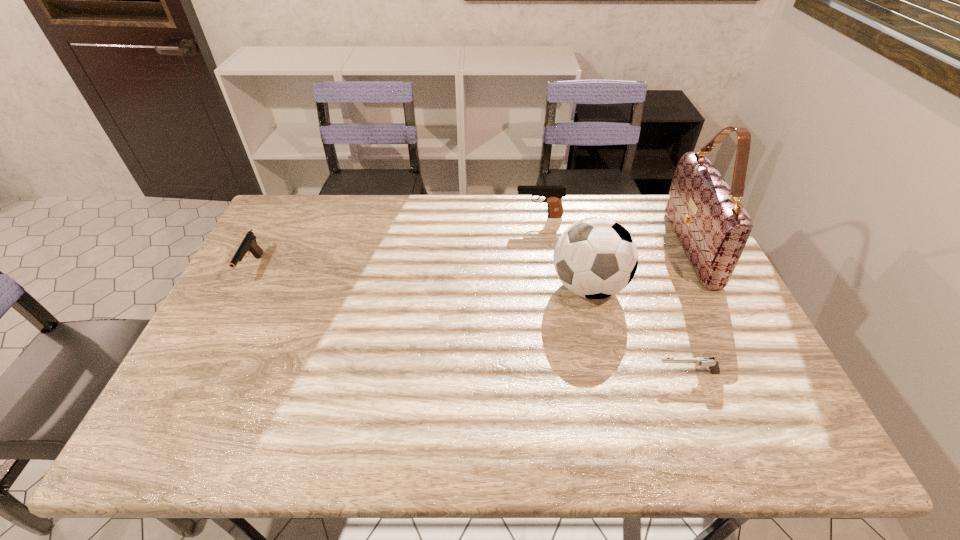
At what (x,y) coordinates should I click in order to perform the action: click on vacant space at the left edge of the desktop. Please return your answer as a coordinate pair (x, y). This screenshot has width=960, height=540. Looking at the image, I should click on (272, 308).

At what (x,y) coordinates should I click in order to perform the action: click on vacant region at the right edge. Please return your answer as a coordinate pair (x, y). The height and width of the screenshot is (540, 960). Looking at the image, I should click on (755, 373).

In order to click on free space at the far left corner of the desktop in this screenshot , I will do point(288,208).

Find the location of `blank area at the far right corner`. blank area at the far right corner is located at coordinates (660, 201).

Where is `vacant space that's between the leftmost object and the nearest object`? vacant space that's between the leftmost object and the nearest object is located at coordinates (470, 321).

Identify the location of free space between the tallest object and the soccer ball. (639, 267).

You are a GUI agent. You are given a task and a screenshot of the screen. Output one action in this format:
    pyautogui.click(x=<x>, y=<y>)
    Task: Click on the empty location between the second farthest pistol and the second pistol from left to right
    The image size is (960, 540).
    Given the screenshot: What is the action you would take?
    pyautogui.click(x=396, y=242)

What are the coordinates of `vacant region between the leftmost object and the fourth object from left to right` in the screenshot? It's located at (470, 321).

What are the coordinates of `vacant region between the rightmost pistol and the second shortest pistol` in the screenshot? It's located at (470, 321).

Image resolution: width=960 pixels, height=540 pixels. In order to click on empty space that is in between the tallest object and the nearest object in this screenshot , I will do `click(688, 310)`.